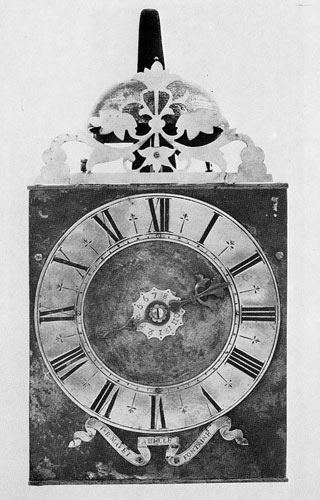
At what (x,y) coordinates should I click in order to perform the action: click on frame of clock. Please return your answer as a coordinate pair (x, y). The image size is (320, 500). Looking at the image, I should click on (54, 463), (40, 212), (261, 201), (277, 469).